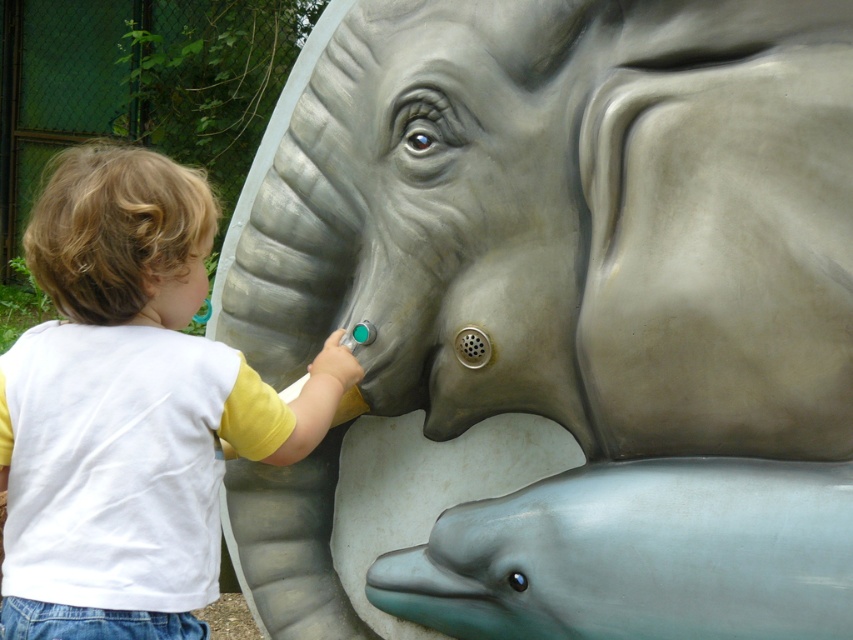
Question: Can you confirm if white/yellow t-shirt at left is bigger than smooth gray dolphin at lower center?

Choices:
 (A) yes
 (B) no

Answer: (A)

Question: Which point is farther from the camera taking this photo?

Choices:
 (A) (108, 157)
 (B) (689, 634)

Answer: (A)

Question: Does white/yellow t-shirt at left have a lesser width compared to smooth gray dolphin at lower center?

Choices:
 (A) no
 (B) yes

Answer: (B)

Question: Among these points, which one is nearest to the camera?

Choices:
 (A) (560, 621)
 (B) (148, 166)

Answer: (B)

Question: Can you confirm if white/yellow t-shirt at left is bigger than smooth gray dolphin at lower center?

Choices:
 (A) yes
 (B) no

Answer: (A)

Question: Which object is closer to the camera taking this photo?

Choices:
 (A) smooth gray dolphin at lower center
 (B) white/yellow t-shirt at left

Answer: (A)